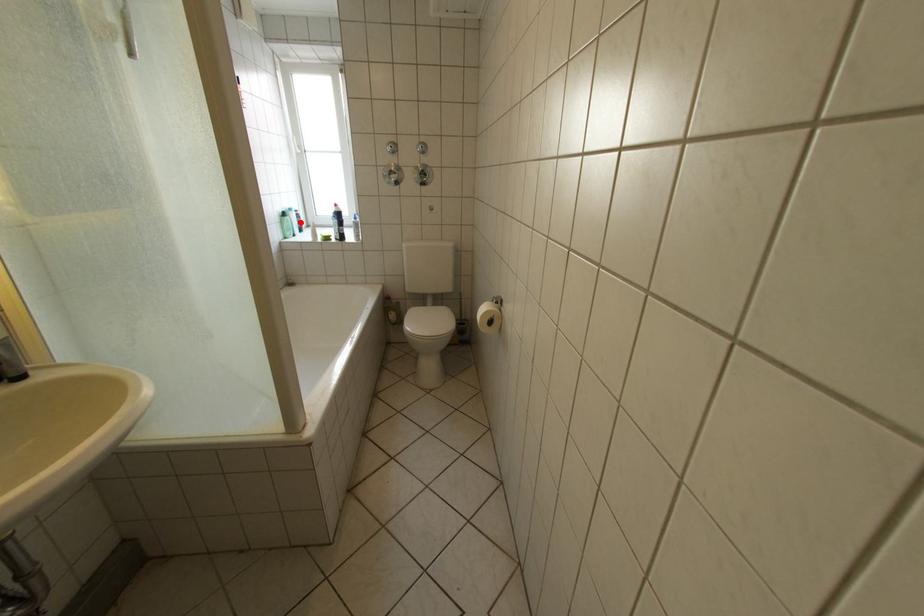
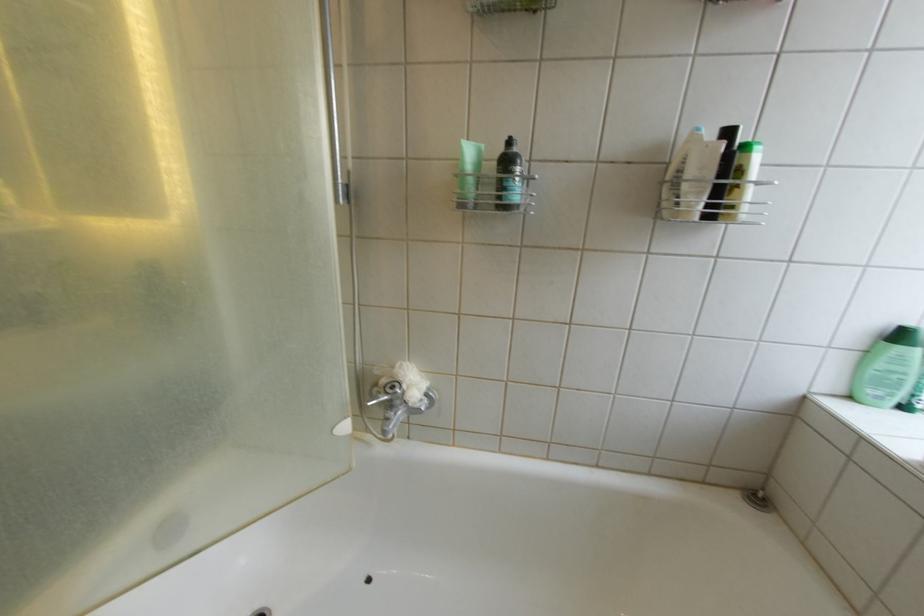
Where in the second image is the point corresponding to the highlighted location from the first image?

(914, 361)